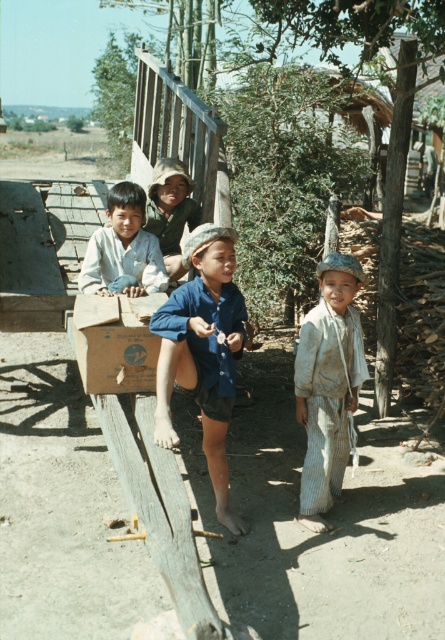
Question: Which is nearer to the matte blue shirt at center?

Choices:
 (A) light brown fabric hat at center
 (B) light brown striped pants at center
 (C) blue cotton shirt at center
 (D) brown cardboard box at center

Answer: (A)

Question: Does light brown striped pants at center appear on the left side of light brown fabric hat at center?

Choices:
 (A) yes
 (B) no

Answer: (B)

Question: Where is brown cardboard box at center located in relation to matte blue shirt at center in the image?

Choices:
 (A) above
 (B) below

Answer: (B)

Question: Which object is farther from the camera taking this photo?

Choices:
 (A) light brown fabric hat at center
 (B) brown cardboard box at center

Answer: (A)

Question: Considering the relative positions of blue cotton shirt at center and matte blue shirt at center in the image provided, where is blue cotton shirt at center located with respect to matte blue shirt at center?

Choices:
 (A) right
 (B) left

Answer: (A)

Question: Which point is closer to the camera?

Choices:
 (A) (133, 269)
 (B) (181, 314)
 (C) (331, 401)
 (D) (179, 228)

Answer: (B)